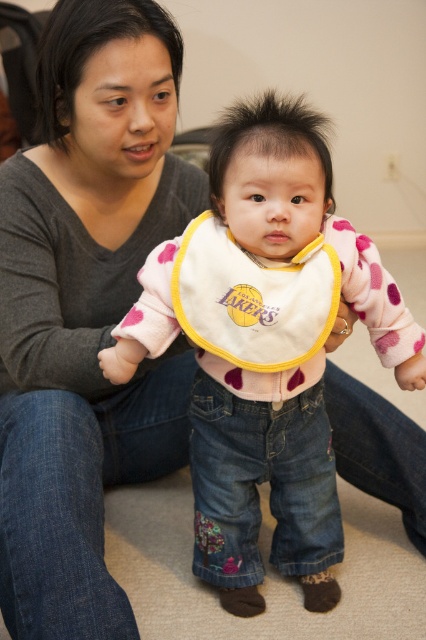
Question: Considering the real-world distances, which object is farthest from the matte gray sweater at center?

Choices:
 (A) white/yellow fabric bib at center
 (B) pink fleece bib at center

Answer: (A)

Question: Is matte gray sweater at center to the left of white/yellow fabric bib at center from the viewer's perspective?

Choices:
 (A) yes
 (B) no

Answer: (A)

Question: Among these objects, which one is farthest from the camera?

Choices:
 (A) pink fleece bib at center
 (B) matte gray sweater at center

Answer: (A)

Question: Can you confirm if pink fleece bib at center is thinner than white/yellow fabric bib at center?

Choices:
 (A) yes
 (B) no

Answer: (B)

Question: Observing the image, what is the correct spatial positioning of matte gray sweater at center in reference to pink fleece bib at center?

Choices:
 (A) left
 (B) right

Answer: (A)

Question: Which point appears farthest from the camera in this image?

Choices:
 (A) (6, 356)
 (B) (192, 330)

Answer: (A)